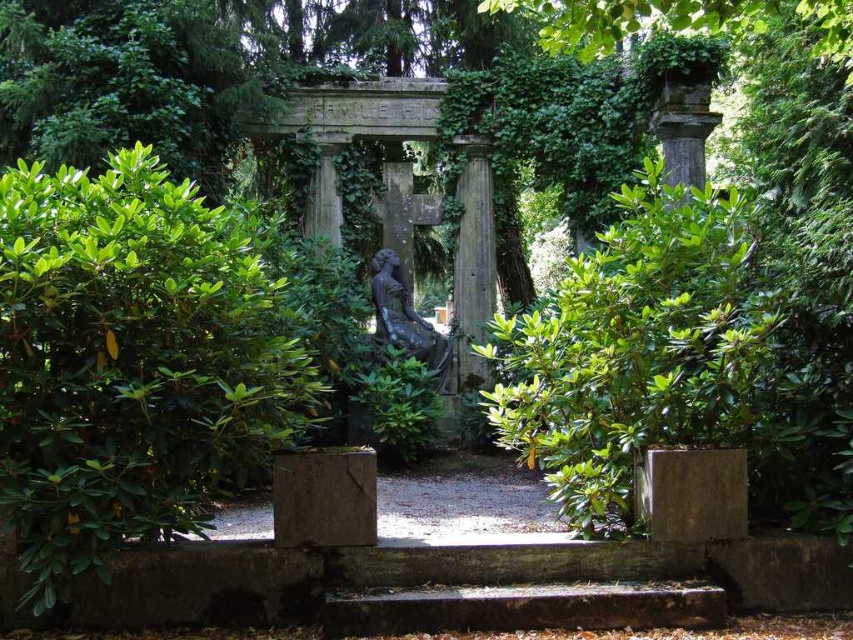
You are a visitor at the cemetery and want to take a photo of the bronze statue at center without the stone column at center appearing in the frame. Is this possible given their positions?

The stone column at center is located above the bronze statue at center, so if you position yourself below the statue or adjust your angle to avoid the column above, it is possible to take a photo of the bronze statue at center without the stone column at center in the frame.

You are a visitor at the cemetery and want to take a photo of both the green leafy bush at center and the stone column at center. Which object should you focus on first to ensure both are in the frame?

You should focus on the green leafy bush at center first because it is closer to the viewer than the stone column at center, so adjusting the camera to include it will also capture the stone column at center in the background.